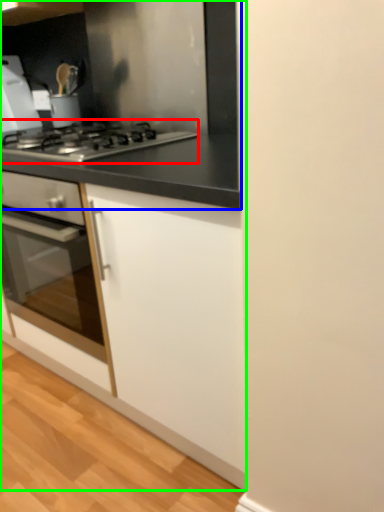
Question: Which object is positioned closest to gas stove (highlighted by a red box)? Select from countertop (highlighted by a blue box) and cabinetry (highlighted by a green box).

Choices:
 (A) countertop
 (B) cabinetry

Answer: (A)